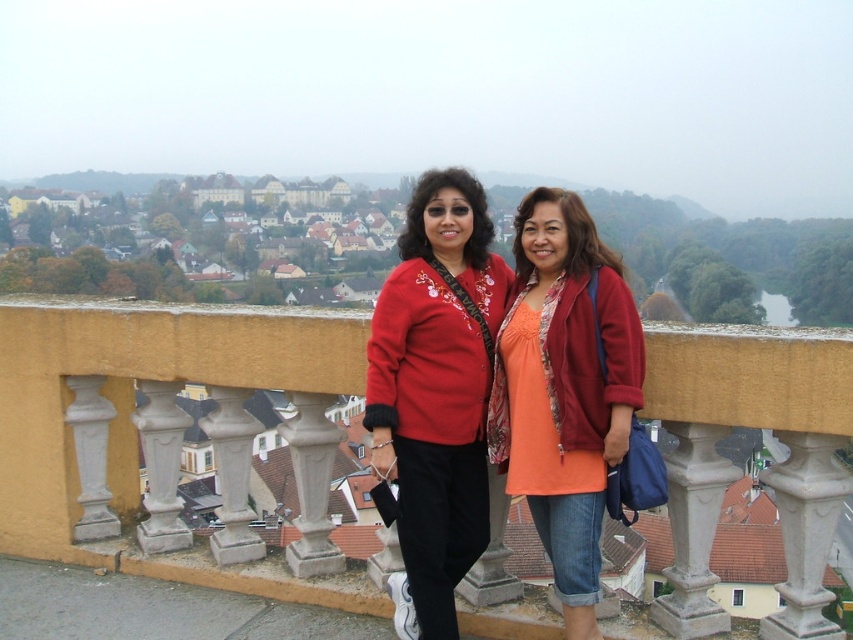
You are a photographer trying to capture both the yellow stone bridge at center and the matte red sweater at center in the same frame. What is the minimum distance you need to move backward to ensure both objects are fully visible?

The yellow stone bridge at center and the matte red sweater at center are 6.08 meters apart from each other. To capture both in the same frame, the photographer needs to move backward until the distance between the two objects fits within the camera frame. The exact distance depends on the camera lens and sensor size, but a rough estimate would be moving back at least 6.08 meters to ensure both are visible.

Please provide the exact coordinates of the matte red sweater at center in the image. The coordinate system is defined as follows. The origin is the bottom left corner of the image. The x axis is along the horizontal direction from left to right, and the y axis is along the vertical direction from bottom to top. The coordinates are normalized between 0 and 1. Please answer in the format of a tuple with two decimal numbers, e.g., 0.5, 0.5.

The exact coordinates of the matte red sweater at center are at point (436, 387).